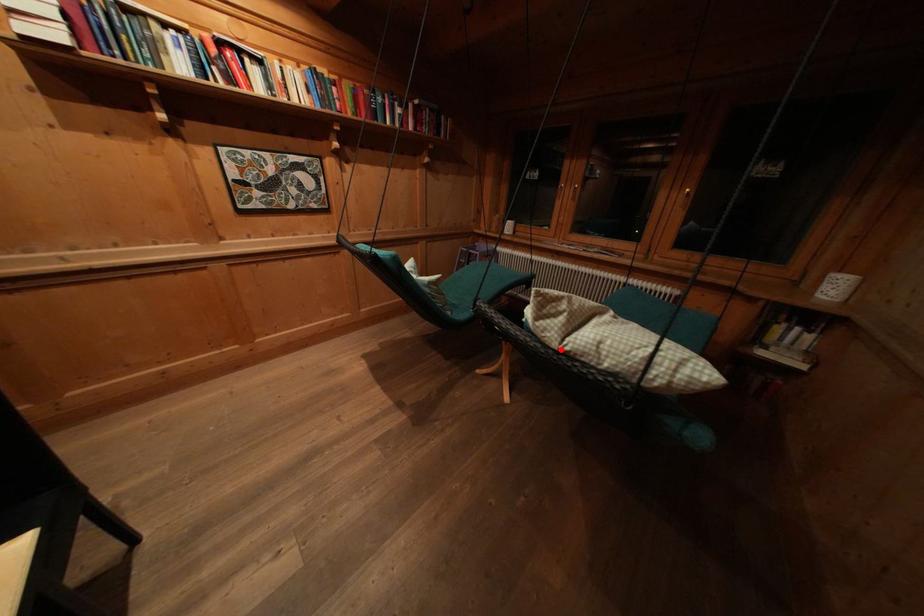
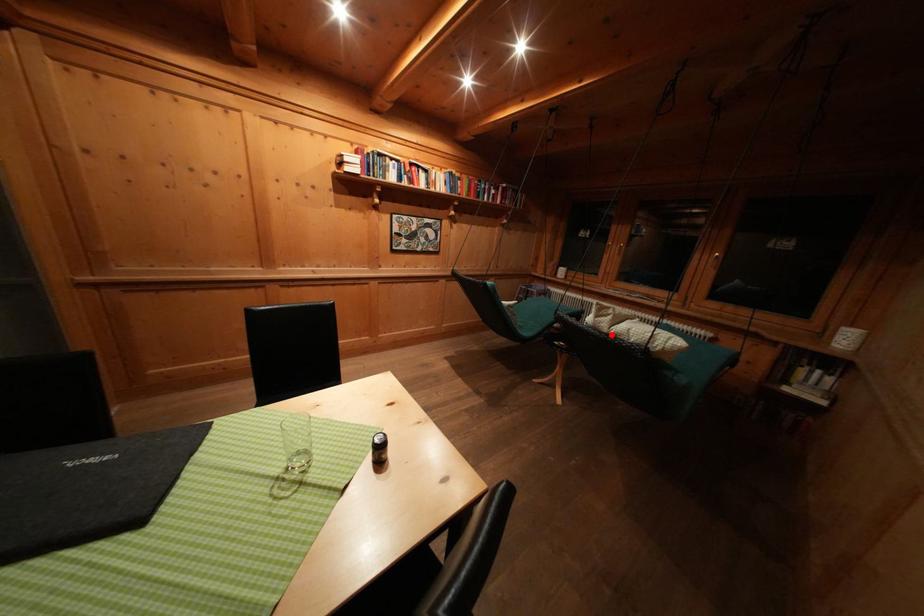
I am providing you with two images of the same scene from different viewpoints. A red point is marked on the first image and another point is marked on the second image. Is the marked point in image1 the same physical position as the marked point in image2?

Yes